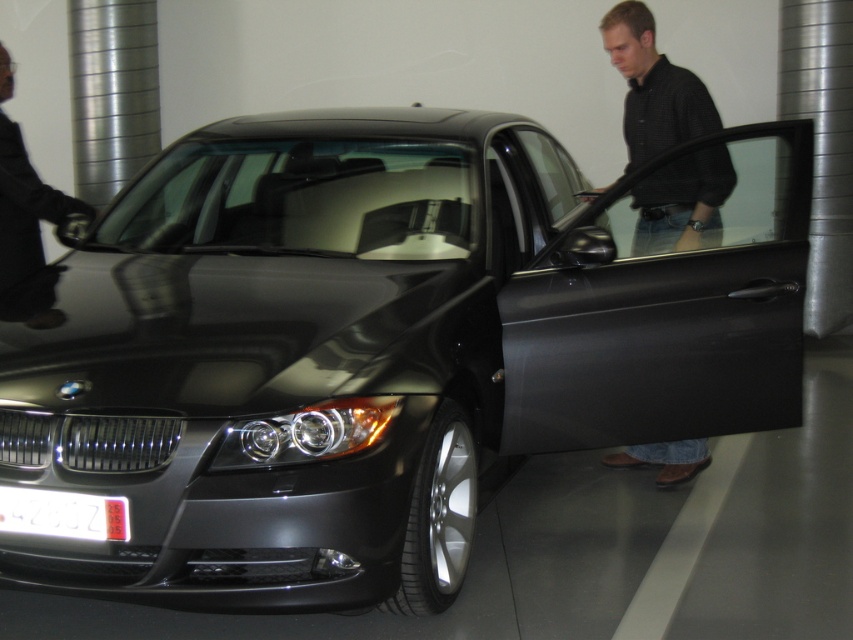
Which is above, matte black jacket at left or white plastic license plate at lower left?

matte black jacket at left is higher up.

Is matte black jacket at left taller than white plastic license plate at lower left?

Yes, matte black jacket at left is taller than white plastic license plate at lower left.

Between point (9, 298) and point (38, 531), which one is positioned behind?

The point (9, 298) is behind.

Identify the location of matte black jacket at left. (27, 214).

Between point (1, 115) and point (611, 19), which one is positioned behind?

Point (611, 19)

Does matte black jacket at left have a greater width compared to dark gray shirt at center?

Yes.

Describe the element at coordinates (27, 214) in the screenshot. I see `matte black jacket at left` at that location.

Where is `matte black jacket at left`? Image resolution: width=853 pixels, height=640 pixels. matte black jacket at left is located at coordinates (27, 214).

Who is more distant from viewer, (x=635, y=68) or (x=33, y=508)?

The point (x=635, y=68) is behind.

Does dark gray shirt at center have a lesser width compared to white plastic license plate at lower left?

No, dark gray shirt at center is not thinner than white plastic license plate at lower left.

Does point (679, 456) come behind point (111, 504)?

Yes, point (679, 456) is behind point (111, 504).

In order to click on dark gray shirt at center in this screenshot , I will do `click(630, 45)`.